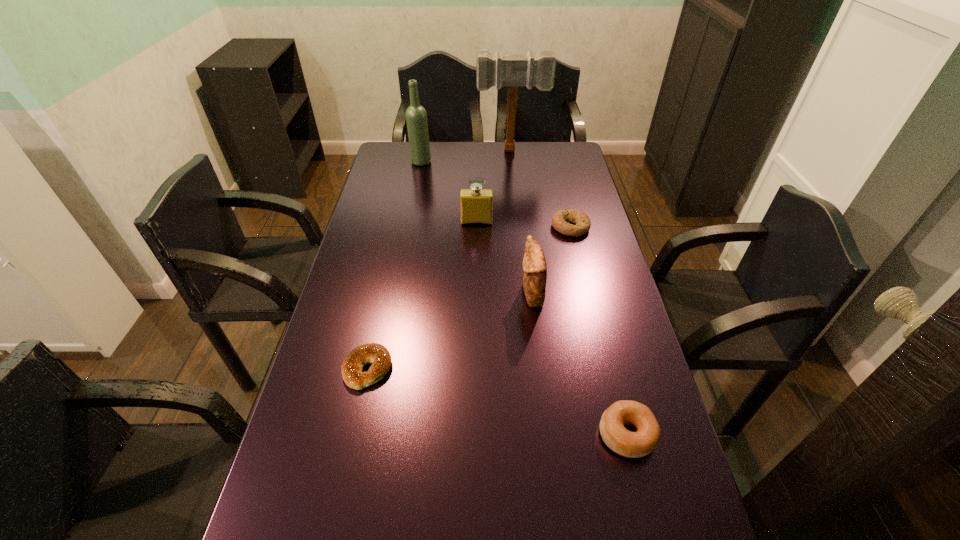
At what (x,y) coordinates should I click in order to perform the action: click on the farthest object. Please return your answer as a coordinate pair (x, y). The height and width of the screenshot is (540, 960). Looking at the image, I should click on (512, 70).

Where is `mallet`? This screenshot has height=540, width=960. mallet is located at coordinates (512, 70).

Where is `wine bottle`? The width and height of the screenshot is (960, 540). wine bottle is located at coordinates (416, 117).

The height and width of the screenshot is (540, 960). I want to click on the second tallest object, so click(x=416, y=117).

Image resolution: width=960 pixels, height=540 pixels. What are the coordinates of `perfume` in the screenshot? It's located at (475, 203).

Identify the location of clutch bag. This screenshot has width=960, height=540. (534, 265).

You are a GUI agent. You are given a task and a screenshot of the screen. Output one action in this format:
    pyautogui.click(x=<x>, y=<y>)
    Task: Click on the nearest object
    
    Given the screenshot: What is the action you would take?
    pyautogui.click(x=642, y=442)

At what (x,y) coordinates should I click in order to perform the action: click on the fifth tallest object. Please return your answer as a coordinate pair (x, y). Image resolution: width=960 pixels, height=540 pixels. Looking at the image, I should click on (642, 442).

Image resolution: width=960 pixels, height=540 pixels. Find the location of `the farthest bagel`. the farthest bagel is located at coordinates (561, 220).

This screenshot has width=960, height=540. I want to click on the second nearest object, so click(x=352, y=367).